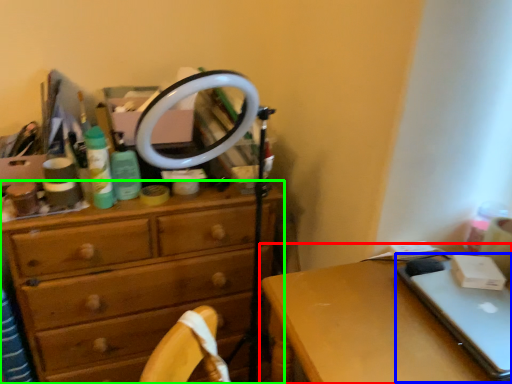
Question: Which object is the farthest from desk (highlighted by a red box)? Choose among these: laptop (highlighted by a blue box) or chest of drawers (highlighted by a green box).

Choices:
 (A) laptop
 (B) chest of drawers

Answer: (B)